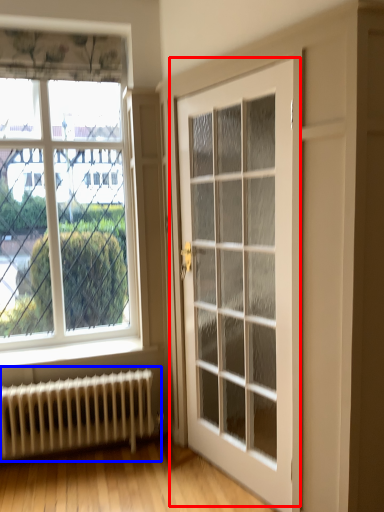
Question: Which point is further to the camera, door (highlighted by a red box) or radiator (highlighted by a blue box)?

Choices:
 (A) door
 (B) radiator

Answer: (B)